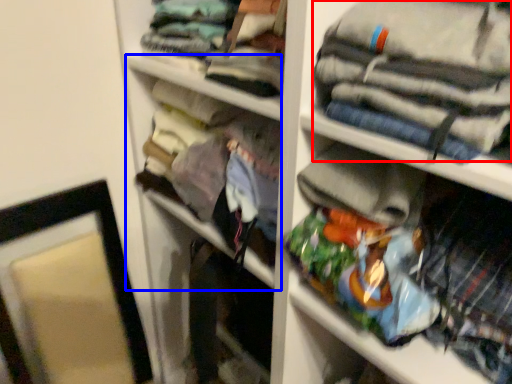
Question: Which object is further to the camera taking this photo, clothing (highlighted by a red box) or cabinet (highlighted by a blue box)?

Choices:
 (A) clothing
 (B) cabinet

Answer: (B)